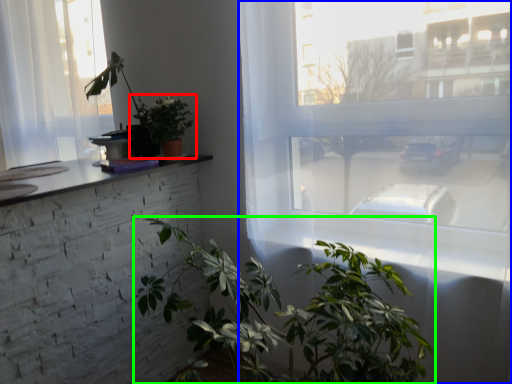
Question: Which object is positioned farthest from houseplant (highlighted by a red box)? Select from window (highlighted by a blue box) and houseplant (highlighted by a green box).

Choices:
 (A) window
 (B) houseplant

Answer: (B)